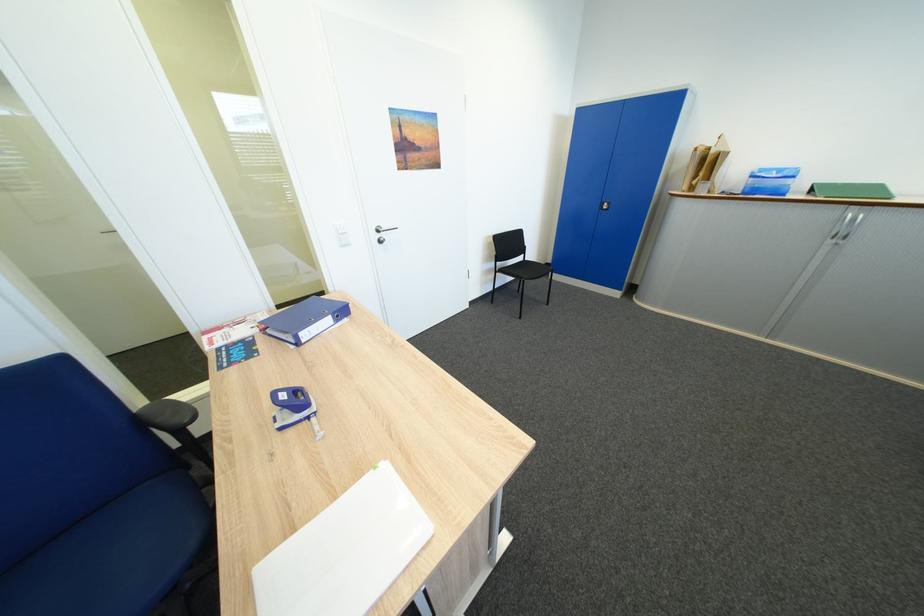
The image size is (924, 616). Identify the location of silver cabinet handle. (604, 205).